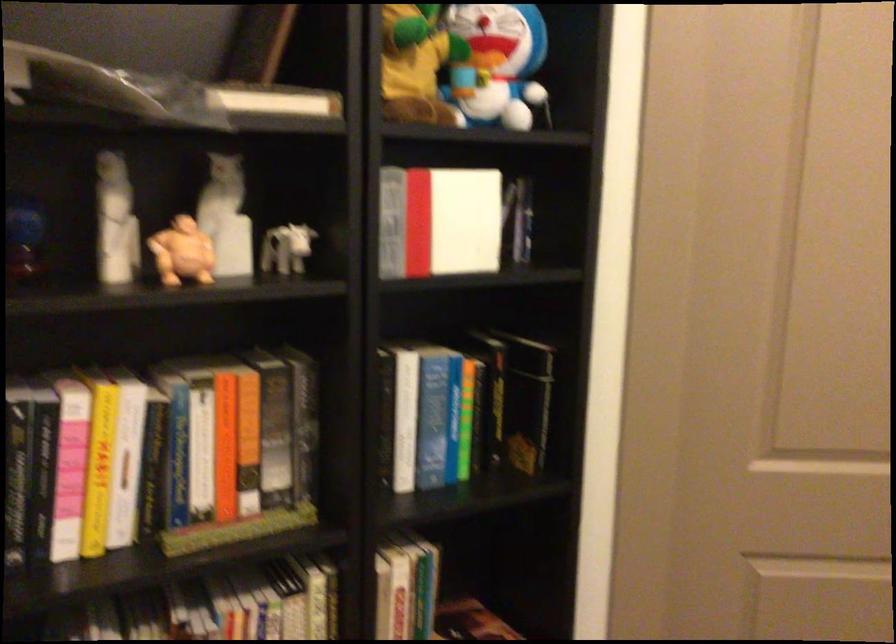
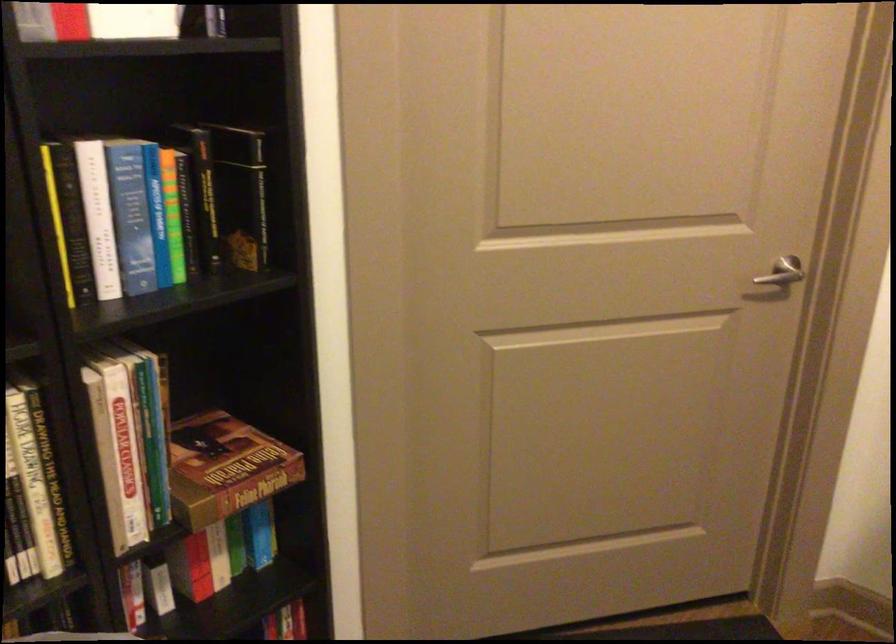
In the second image, find the point that corresponds to point 455,412 in the first image.

(156, 214)